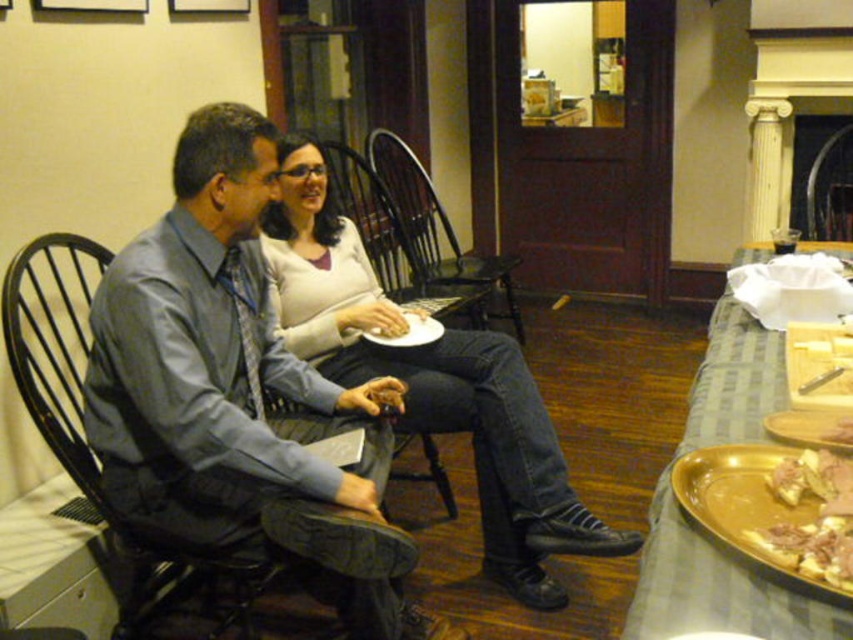
Question: Can you confirm if matte white sweater at center is positioned above golden textured bread at lower right?

Choices:
 (A) yes
 (B) no

Answer: (A)

Question: Estimate the real-world distances between objects in this image. Which object is farther from the gold metallic tray at right?

Choices:
 (A) matte white sweater at center
 (B) golden brown crispy bread at lower right

Answer: (A)

Question: Which object is closer to the camera taking this photo?

Choices:
 (A) matte white sweater at center
 (B) gold metallic platter at lower right
 (C) golden textured bread at lower right

Answer: (C)

Question: Is matte white sweater at center further to the viewer compared to gold metallic tray at right?

Choices:
 (A) no
 (B) yes

Answer: (B)

Question: Which point is closer to the camera?

Choices:
 (A) (544, 580)
 (B) (833, 451)

Answer: (B)

Question: Is black wood chair at center positioned at the back of gold metallic platter at lower right?

Choices:
 (A) no
 (B) yes

Answer: (B)